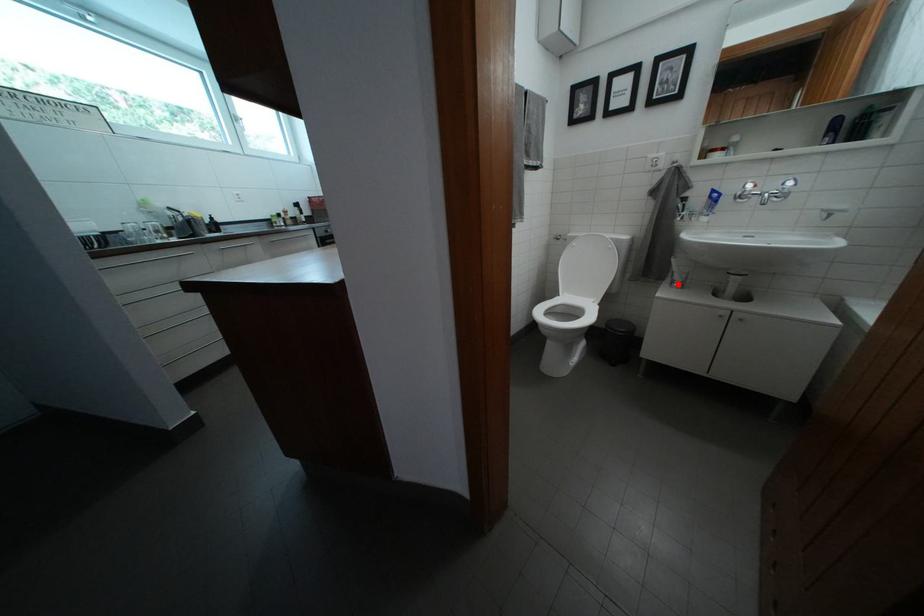
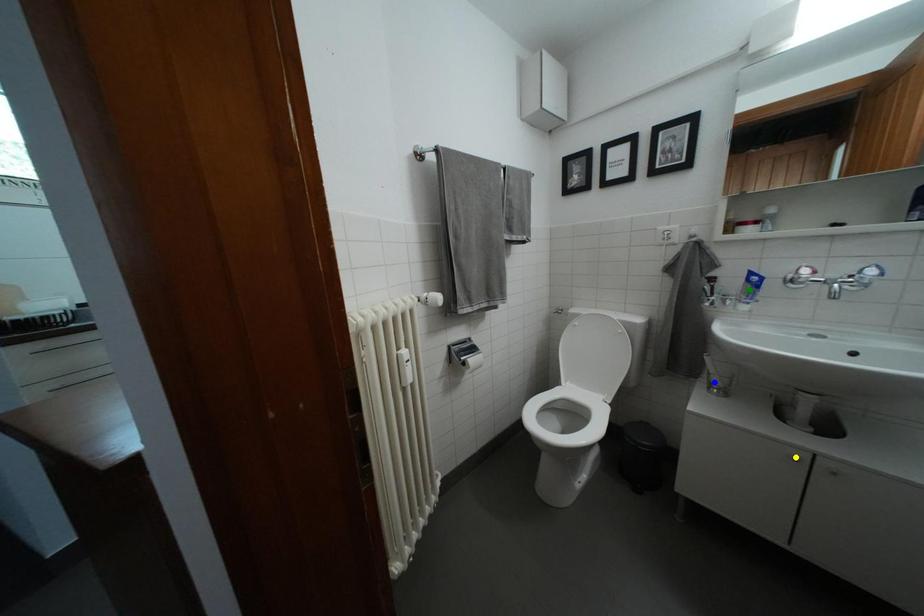
Question: I am providing you with two images of the same scene from different viewpoints. A red point is marked on the first image. You are given multiple points on the second image. Which spot in image 2 lines up with the point in image 1?

Choices:
 (A) blue point
 (B) green point
 (C) yellow point

Answer: (A)